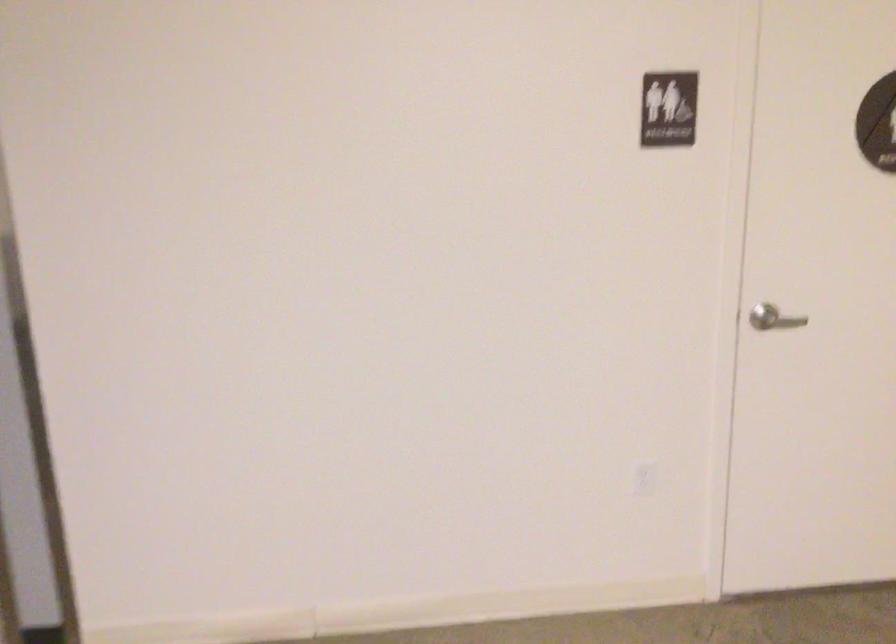
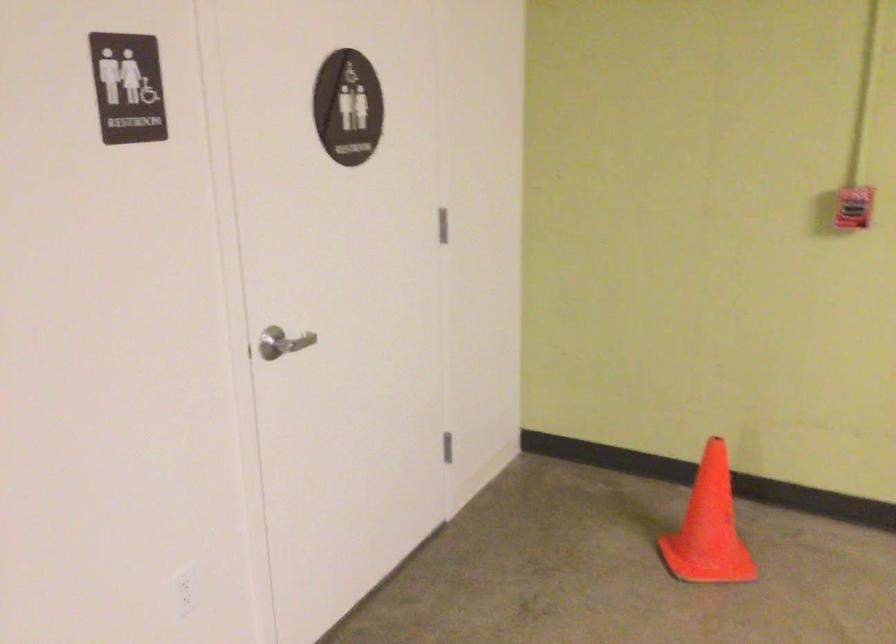
Question: The camera is either moving clockwise (left) or counter-clockwise (right) around the object. The first image is from the beginning of the video and the second image is from the end. Is the camera moving left or right when shooting the video?

Choices:
 (A) Left
 (B) Right

Answer: (A)